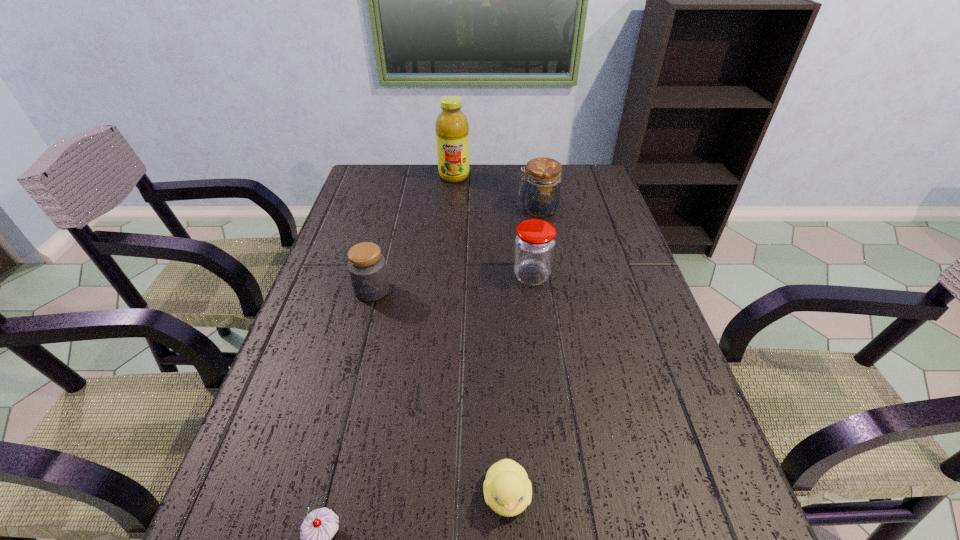
I want to click on free space located on the surface of the shortest jar near the warning symbol, so click(x=365, y=321).

The image size is (960, 540). Identify the location of fruit juice present at the far edge. (452, 128).

You are a GUI agent. You are given a task and a screenshot of the screen. Output one action in this format:
    pyautogui.click(x=<x>, y=<y>)
    Task: Click on the jar that is at the far edge
    The height and width of the screenshot is (540, 960).
    Given the screenshot: What is the action you would take?
    pyautogui.click(x=541, y=193)

At what (x,y) coordinates should I click in order to perform the action: click on object that is positioned at the left edge. Please return your answer as a coordinate pair (x, y). The height and width of the screenshot is (540, 960). Looking at the image, I should click on (367, 269).

In the image, there is a desktop. Identify the location of vacant space at the far edge. (491, 165).

This screenshot has width=960, height=540. In order to click on vacant space at the left edge of the desktop in this screenshot , I will do `click(324, 339)`.

Identify the location of vacant space at the right edge. (588, 285).

Locate an element on the screen. vacant space at the far left corner of the desktop is located at coordinates (369, 166).

Where is `vacant area at the far right corner`? The height and width of the screenshot is (540, 960). vacant area at the far right corner is located at coordinates (600, 179).

Where is `free space that is in between the tallest object and the duckling`? The height and width of the screenshot is (540, 960). free space that is in between the tallest object and the duckling is located at coordinates (481, 336).